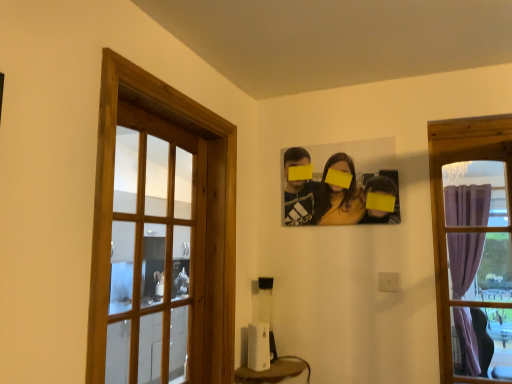
Question: Considering the relative positions of matte black photo frame at upper center and white plastic speaker at lower center in the image provided, is matte black photo frame at upper center in front of white plastic speaker at lower center?

Choices:
 (A) no
 (B) yes

Answer: (A)

Question: Is matte black photo frame at upper center aimed at white plastic speaker at lower center?

Choices:
 (A) no
 (B) yes

Answer: (A)

Question: From a real-world perspective, is matte black photo frame at upper center positioned over white plastic speaker at lower center based on gravity?

Choices:
 (A) no
 (B) yes

Answer: (B)

Question: Is matte black photo frame at upper center at the left side of white plastic speaker at lower center?

Choices:
 (A) no
 (B) yes

Answer: (A)

Question: From the image's perspective, is matte black photo frame at upper center located above white plastic speaker at lower center?

Choices:
 (A) yes
 (B) no

Answer: (A)

Question: From a real-world perspective, does matte black photo frame at upper center sit lower than white plastic speaker at lower center?

Choices:
 (A) yes
 (B) no

Answer: (B)

Question: Are matte black photo frame at upper center and wooden frame at left, the second window in the right-to-left sequence, making contact?

Choices:
 (A) yes
 (B) no

Answer: (B)

Question: From a real-world perspective, is matte black photo frame at upper center over wooden frame at left, the 1th window from the left?

Choices:
 (A) yes
 (B) no

Answer: (A)

Question: Is matte black photo frame at upper center not near wooden frame at left, the second window in the right-to-left sequence?

Choices:
 (A) yes
 (B) no

Answer: (B)

Question: Considering the relative sizes of matte black photo frame at upper center and wooden frame at left, the second window in the right-to-left sequence, in the image provided, is matte black photo frame at upper center taller than wooden frame at left, the second window in the right-to-left sequence,?

Choices:
 (A) no
 (B) yes

Answer: (A)

Question: Considering the relative sizes of matte black photo frame at upper center and wooden frame at left, the second window in the right-to-left sequence, in the image provided, is matte black photo frame at upper center thinner than wooden frame at left, the second window in the right-to-left sequence,?

Choices:
 (A) yes
 (B) no

Answer: (A)

Question: Is matte black photo frame at upper center at the right side of wooden frame at left, the 1th window from the left?

Choices:
 (A) yes
 (B) no

Answer: (A)

Question: Considering the relative sizes of white plastic speaker at lower center and purple curtain at right, placed as the first window when sorted from right to left, in the image provided, is white plastic speaker at lower center shorter than purple curtain at right, placed as the first window when sorted from right to left,?

Choices:
 (A) no
 (B) yes

Answer: (B)